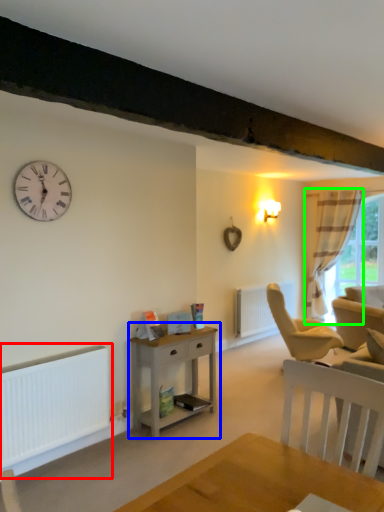
Question: Which object is positioned closest to heater (highlighted by a red box)? Select from nightstand (highlighted by a blue box) and curtain (highlighted by a green box).

Choices:
 (A) nightstand
 (B) curtain

Answer: (A)